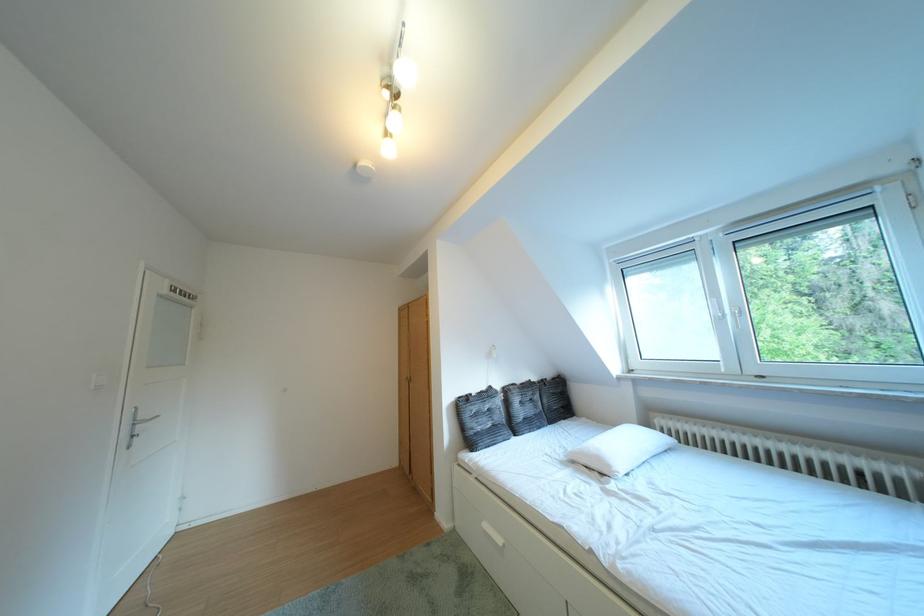
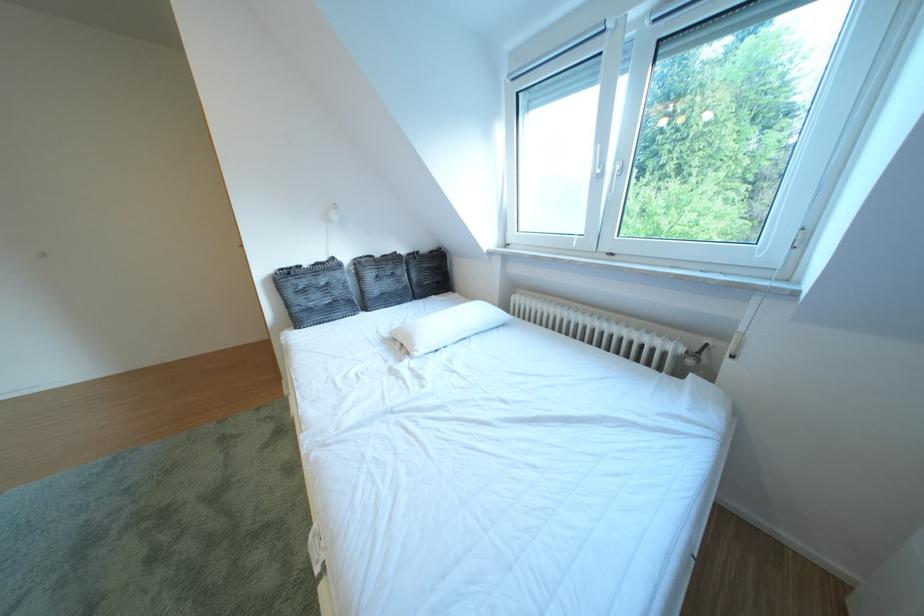
Question: Based on the continuous images, in which direction is the camera rotating? Reply with the corresponding letter.

Choices:
 (A) Left
 (B) Right
 (C) Up
 (D) Down

Answer: (D)